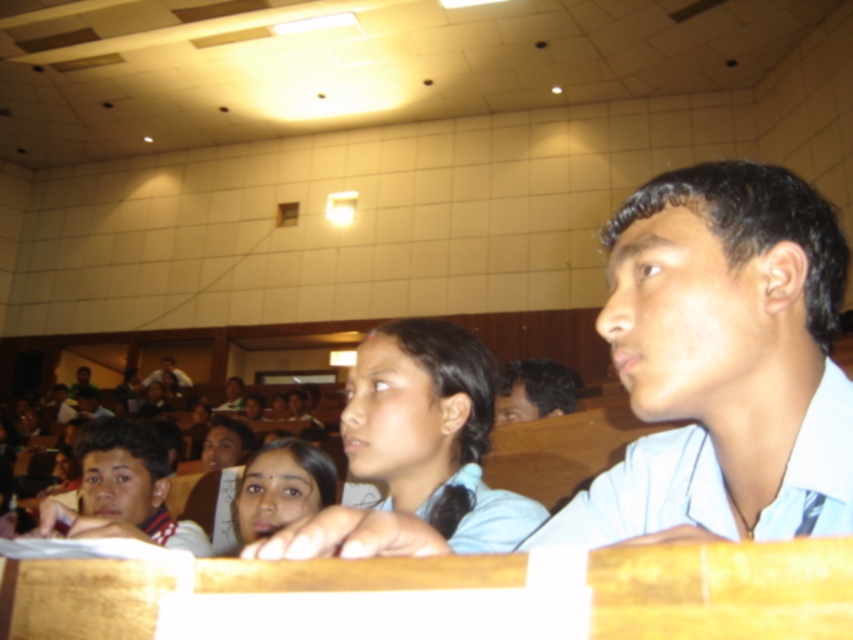
Question: Estimate the real-world distances between objects in this image. Which object is closer to the matte white shirt at left?

Choices:
 (A) light blue shirt at center
 (B) dark brown hair at center
 (C) light brown wooden desk at center
 (D) matte black shirt at lower left

Answer: (B)

Question: Which point is closer to the camera?

Choices:
 (A) (537, 362)
 (B) (73, 394)

Answer: (A)

Question: Is light brown wooden desk at center above matte black shirt at lower left?

Choices:
 (A) yes
 (B) no

Answer: (A)

Question: Is light blue shirt at center smaller than matte black shirt at lower left?

Choices:
 (A) yes
 (B) no

Answer: (A)

Question: Can you confirm if light blue shirt at center is thinner than matte black shirt at lower left?

Choices:
 (A) yes
 (B) no

Answer: (A)

Question: Estimate the real-world distances between objects in this image. Which object is farther from the dark brown hair at center?

Choices:
 (A) light brown wooden desk at center
 (B) matte white shirt at left
 (C) matte black shirt at lower left
 (D) light blue shirt at center

Answer: (C)